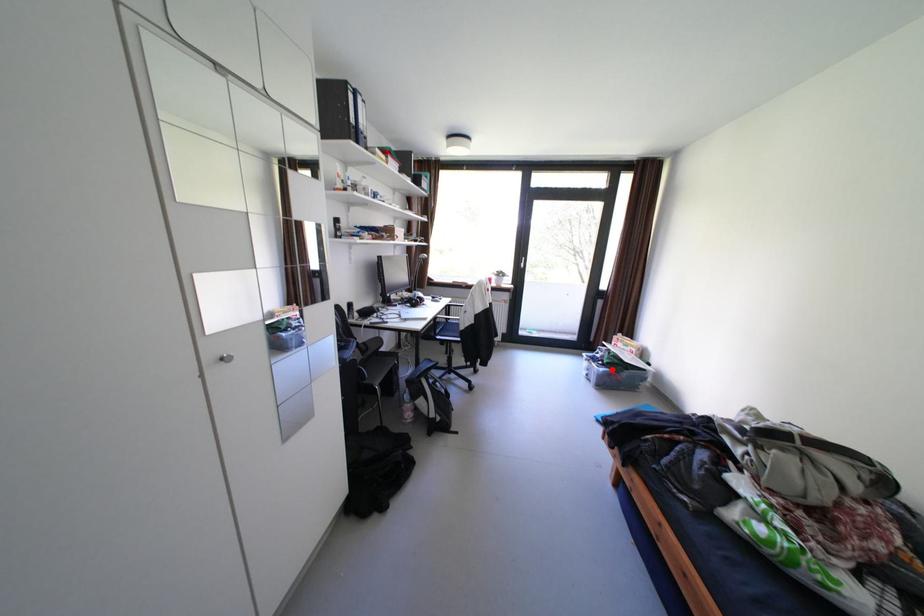
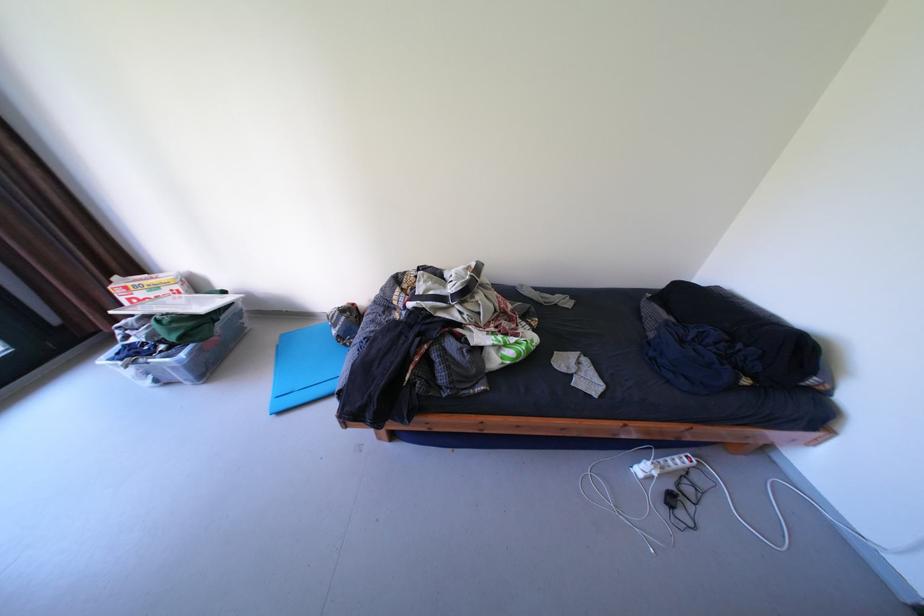
Question: I am providing you with two images of the same scene from different viewpoints. A red point is shown in image1. For the corresponding object point in image2, is it positioned nearer or farther from the camera?

Choices:
 (A) Nearer
 (B) Farther

Answer: (A)